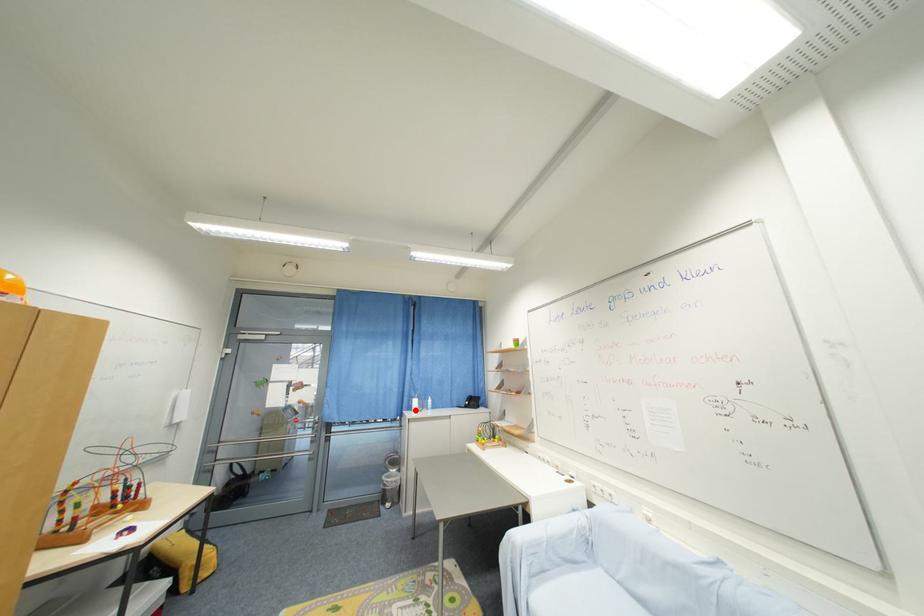
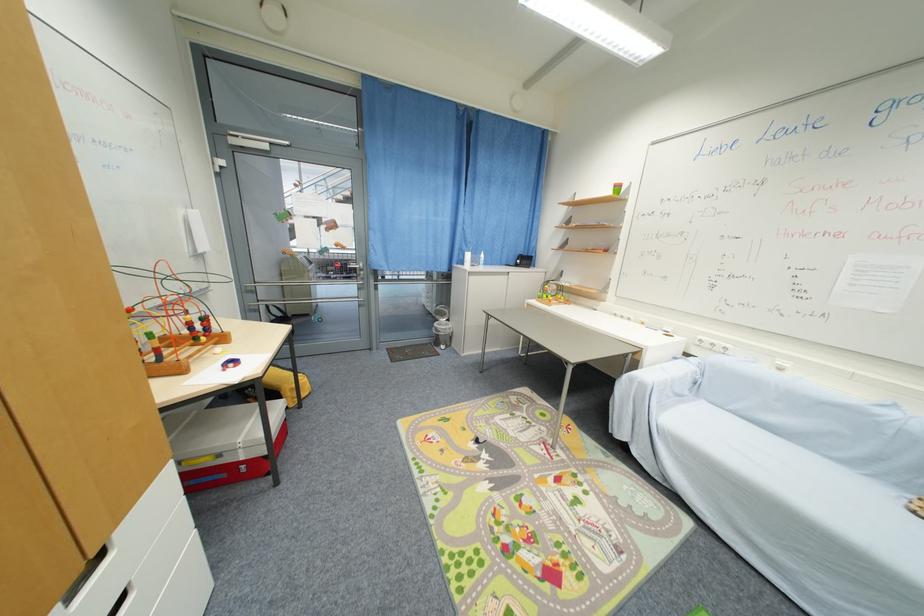
Question: I am providing you with two images of the same scene from different viewpoints. Given a red point in image1, look at the same physical point in image2. Is it:

Choices:
 (A) Closer to the viewpoint
 (B) Farther from the viewpoint

Answer: (A)